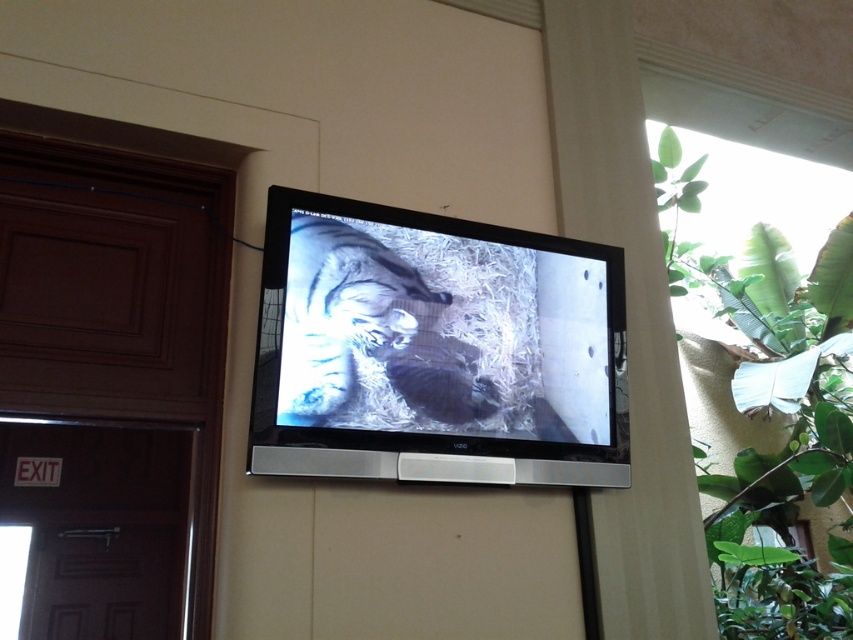
Question: Which point appears farthest from the camera in this image?

Choices:
 (A) (349, 243)
 (B) (827, 340)

Answer: (B)

Question: Can you confirm if matte black tv at center is positioned to the left of green leafy plant at upper right?

Choices:
 (A) yes
 (B) no

Answer: (A)

Question: Is matte black tv at center closer to camera compared to green leafy plant at upper right?

Choices:
 (A) no
 (B) yes

Answer: (B)

Question: Does matte black tv at center have a greater width compared to green leafy plant at upper right?

Choices:
 (A) no
 (B) yes

Answer: (A)